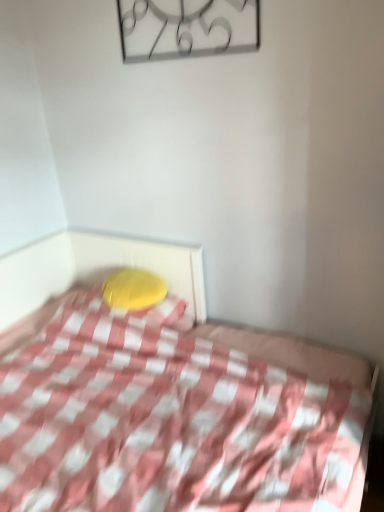
Question: Is pink checkered fabric at center touching yellow fabric pillow at center?

Choices:
 (A) no
 (B) yes

Answer: (A)

Question: Would you consider pink checkered fabric at center to be distant from yellow fabric pillow at center?

Choices:
 (A) yes
 (B) no

Answer: (B)

Question: From the image's perspective, is pink checkered fabric at center under yellow fabric pillow at center?

Choices:
 (A) no
 (B) yes

Answer: (B)

Question: Considering the relative sizes of pink checkered fabric at center and yellow fabric pillow at center in the image provided, is pink checkered fabric at center smaller than yellow fabric pillow at center?

Choices:
 (A) yes
 (B) no

Answer: (B)

Question: From a real-world perspective, is pink checkered fabric at center below yellow fabric pillow at center?

Choices:
 (A) no
 (B) yes

Answer: (B)

Question: In terms of height, does metallic clock at upper center look taller or shorter compared to yellow fabric pillow at center?

Choices:
 (A) tall
 (B) short

Answer: (A)

Question: From a real-world perspective, is metallic clock at upper center above or below yellow fabric pillow at center?

Choices:
 (A) above
 (B) below

Answer: (A)

Question: Is metallic clock at upper center wider or thinner than yellow fabric pillow at center?

Choices:
 (A) thin
 (B) wide

Answer: (A)

Question: In the image, is metallic clock at upper center positioned in front of or behind yellow fabric pillow at center?

Choices:
 (A) behind
 (B) front

Answer: (B)

Question: Does point (162, 286) appear closer or farther from the camera than point (157, 12)?

Choices:
 (A) farther
 (B) closer

Answer: (A)

Question: Relative to metallic clock at upper center, is yellow fabric pillow at center in front or behind?

Choices:
 (A) behind
 (B) front

Answer: (A)

Question: Looking at the image, does yellow fabric pillow at center seem bigger or smaller compared to metallic clock at upper center?

Choices:
 (A) small
 (B) big

Answer: (B)

Question: Considering the positions of yellow fabric pillow at center and metallic clock at upper center in the image, is yellow fabric pillow at center taller or shorter than metallic clock at upper center?

Choices:
 (A) tall
 (B) short

Answer: (B)

Question: From a real-world perspective, is metallic clock at upper center above or below pink checkered fabric at center?

Choices:
 (A) below
 (B) above

Answer: (B)

Question: Is point (218, 37) positioned closer to the camera than point (21, 261)?

Choices:
 (A) farther
 (B) closer

Answer: (B)